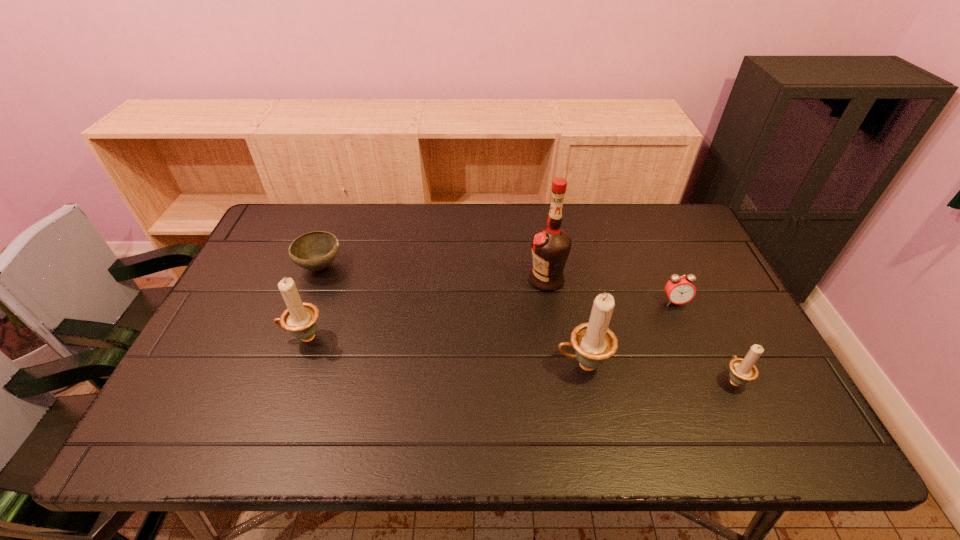
Image resolution: width=960 pixels, height=540 pixels. Find the location of `the leftmost candle_holder`. the leftmost candle_holder is located at coordinates (299, 318).

Locate an element on the screen. Image resolution: width=960 pixels, height=540 pixels. the second tallest candle_holder is located at coordinates (299, 318).

At what (x,y) coordinates should I click in order to perform the action: click on the second candle_holder from left to right. Please return your answer as a coordinate pair (x, y). The image size is (960, 540). Looking at the image, I should click on (593, 341).

Identify the location of the rightmost candle_holder. (743, 370).

You are a GUI agent. You are given a task and a screenshot of the screen. Output one action in this format:
    pyautogui.click(x=<x>, y=<y>)
    Task: Click on the fourth tallest object
    The height and width of the screenshot is (540, 960).
    Given the screenshot: What is the action you would take?
    pyautogui.click(x=743, y=370)

This screenshot has width=960, height=540. Identify the location of the third farthest object. (679, 289).

Find the location of a particular element. Image resolution: width=960 pixels, height=540 pixels. liquor is located at coordinates (551, 246).

I want to click on bowl, so click(x=316, y=250).

You are a GUI agent. You are given a task and a screenshot of the screen. Output one action in this format:
    pyautogui.click(x=<x>, y=<y>)
    Task: Click on the vacant space situated 0.170m on the handle side of the leftmost candle_holder
    This screenshot has height=540, width=960.
    Given the screenshot: What is the action you would take?
    pyautogui.click(x=216, y=338)

I want to click on free space located on the handle side of the leftmost candle_holder, so click(x=251, y=338).